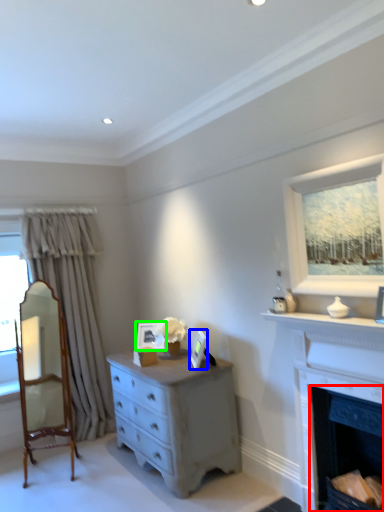
Question: Which is farther away from fireplace (highlighted by a red box)? picture frame (highlighted by a blue box) or picture frame (highlighted by a green box)?

Choices:
 (A) picture frame
 (B) picture frame

Answer: (B)